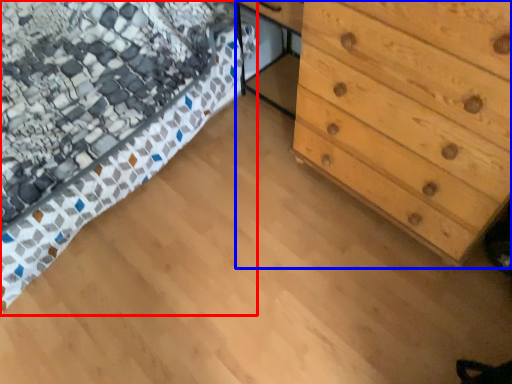
Question: Which object is closer to the camera taking this photo, bed (highlighted by a red box) or chest of drawers (highlighted by a blue box)?

Choices:
 (A) bed
 (B) chest of drawers

Answer: (B)